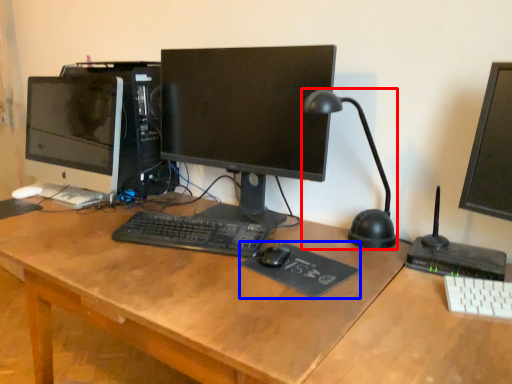
Question: Among these objects, which one is nearest to the camera, table lamp (highlighted by a red box) or mousepad (highlighted by a blue box)?

Choices:
 (A) table lamp
 (B) mousepad

Answer: (A)